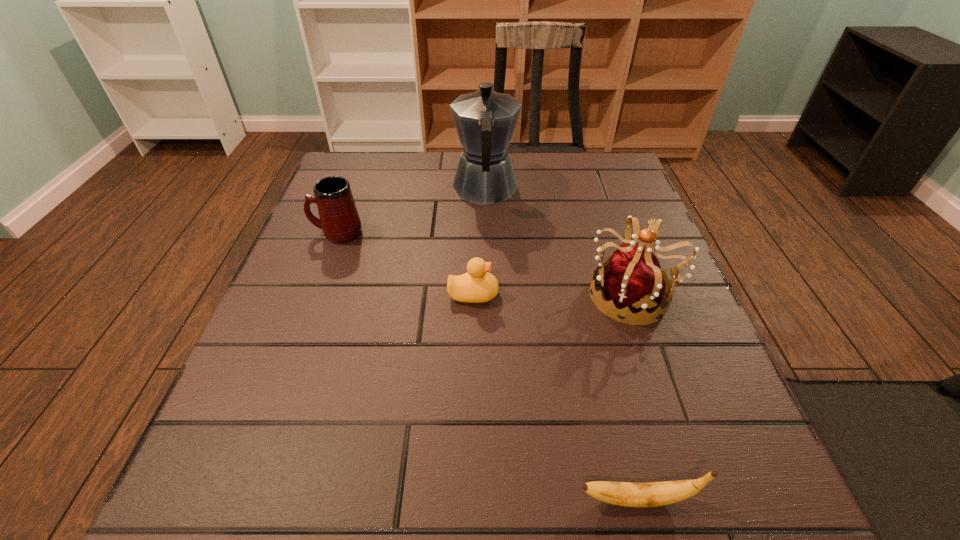
You are a GUI agent. You are given a task and a screenshot of the screen. Output one action in this format:
    pyautogui.click(x=<x>, y=<y>)
    Task: Click on the vacant space located 0.280m on the front-facing side of the tiara
    Image resolution: width=960 pixels, height=540 pixels.
    Given the screenshot: What is the action you would take?
    pyautogui.click(x=442, y=295)

The height and width of the screenshot is (540, 960). I want to click on vacant area situated on the front-facing side of the tiara, so click(524, 295).

At what (x,y) coordinates should I click in order to perform the action: click on vacant space located on the face of the duck. Please return your answer as a coordinate pair (x, y). Looking at the image, I should click on (612, 294).

Find the location of a particular element. This screenshot has width=960, height=540. vacant position located on the peel of the nearest object from the top is located at coordinates (292, 499).

Where is `free space located on the peel of the nearest object from the top`? This screenshot has width=960, height=540. free space located on the peel of the nearest object from the top is located at coordinates (299, 499).

Where is `vacant space situated on the peel of the nearest object from the top`? This screenshot has height=540, width=960. vacant space situated on the peel of the nearest object from the top is located at coordinates (449, 499).

Where is `object located in the far edge section of the desktop`? object located in the far edge section of the desktop is located at coordinates (485, 120).

You are a GUI agent. You are given a task and a screenshot of the screen. Output one action in this format:
    pyautogui.click(x=<x>, y=<y>)
    Task: Click on the object located in the near edge section of the desktop
    This screenshot has height=540, width=960.
    Given the screenshot: What is the action you would take?
    pyautogui.click(x=651, y=494)

Identify the location of object at the left edge. This screenshot has width=960, height=540. (340, 222).

You are a GUI agent. You are given a task and a screenshot of the screen. Output one action in this format:
    pyautogui.click(x=<x>, y=<y>)
    Task: Click on the tiara at the right edge
    Image resolution: width=960 pixels, height=540 pixels.
    Given the screenshot: What is the action you would take?
    pyautogui.click(x=633, y=280)